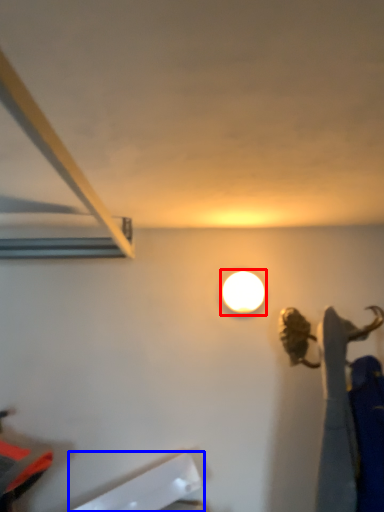
Question: Among these objects, which one is nearest to the camera, lamp (highlighted by a red box) or wide (highlighted by a blue box)?

Choices:
 (A) lamp
 (B) wide

Answer: (B)